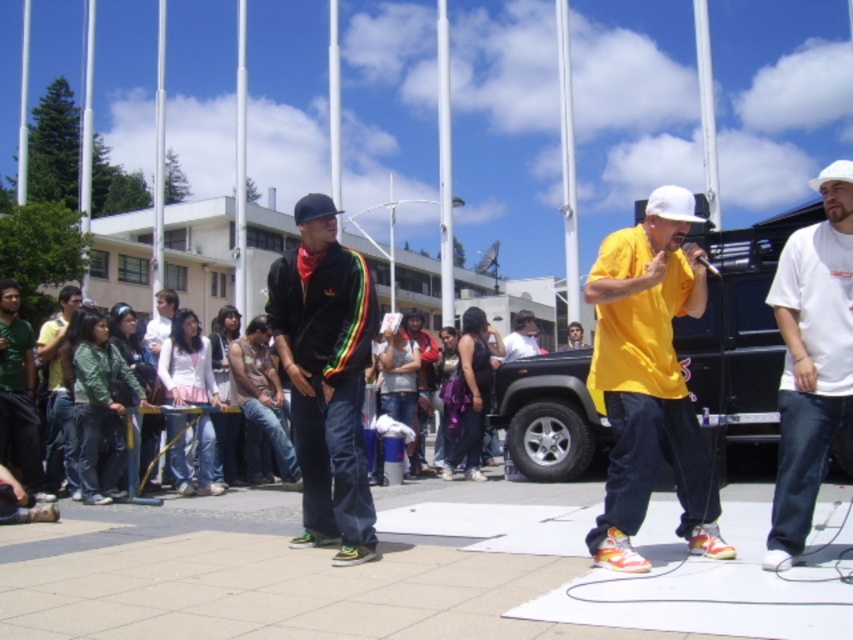
Which of these two, matte yellow t-shirt at center or green denim jacket at lower left, stands shorter?

green denim jacket at lower left

Can you confirm if matte yellow t-shirt at center is positioned to the left of green denim jacket at lower left?

In fact, matte yellow t-shirt at center is to the right of green denim jacket at lower left.

Between point (691, 417) and point (61, 413), which one is positioned in front?

Point (691, 417)

Locate an element on the screen. This screenshot has height=640, width=853. matte yellow t-shirt at center is located at coordinates (648, 380).

Which is more to the right, matte black jacket at center or green matte shirt at lower left?

matte black jacket at center is more to the right.

Does matte black jacket at center come in front of green matte shirt at lower left?

Yes, matte black jacket at center is in front of green matte shirt at lower left.

Is point (306, 195) positioned after point (35, 374)?

Yes, point (306, 195) is farther from viewer.

Identify the location of matte black jacket at center. (326, 376).

Does point (556, 403) come closer to viewer compared to point (786, 353)?

No.

Measure the distance between black matte jeep at center and camera.

black matte jeep at center is 15.31 feet from camera.

Find the location of a particular element. This screenshot has width=853, height=640. black matte jeep at center is located at coordinates click(738, 326).